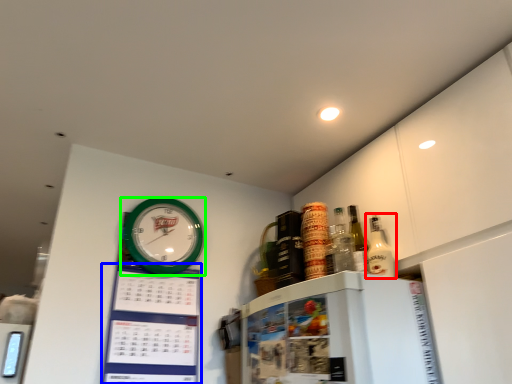
Question: Which object is the closest to the bottle (highlighted by a red box)? Choose among these: bulletin board (highlighted by a blue box) or wall clock (highlighted by a green box).

Choices:
 (A) bulletin board
 (B) wall clock

Answer: (B)